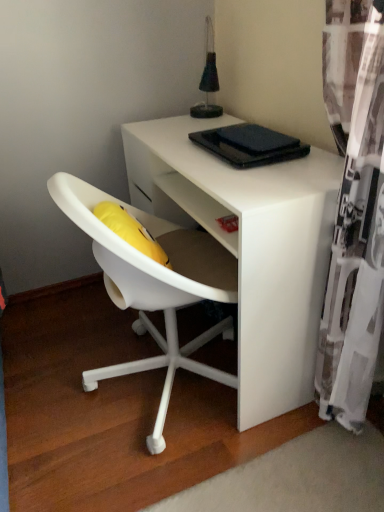
I want to click on free location in front of black matte pad at upper center, so click(x=272, y=169).